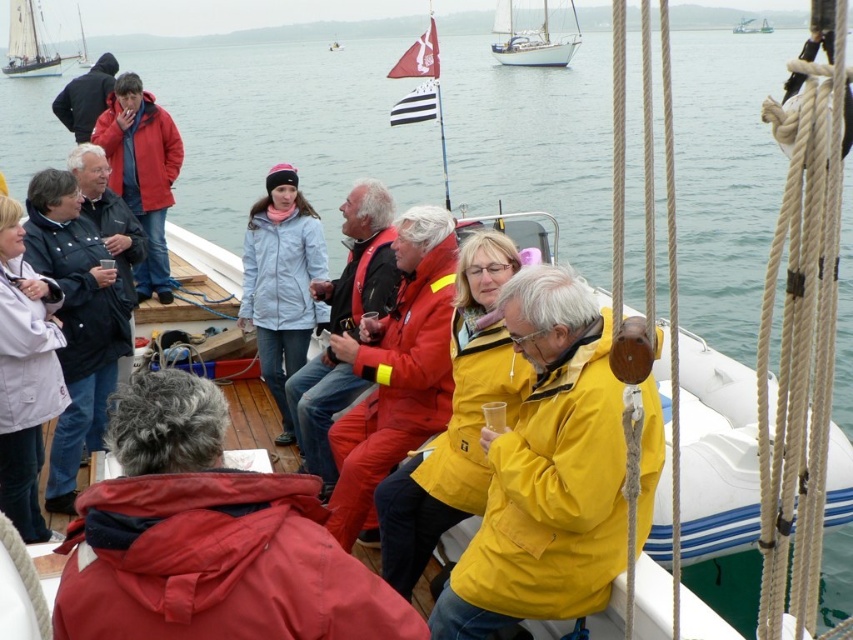
Question: From the image, what is the correct spatial relationship of matte light blue jacket at center in relation to matte red jacket at center?

Choices:
 (A) left
 (B) right

Answer: (A)

Question: Does red matte jacket at center have a smaller size compared to white glossy sailboat at upper center?

Choices:
 (A) yes
 (B) no

Answer: (A)

Question: Is red matte jacket at center further to the viewer compared to white glossy sailboat at upper center?

Choices:
 (A) no
 (B) yes

Answer: (A)

Question: Which point is closer to the camera taking this photo?

Choices:
 (A) (163, 150)
 (B) (9, 323)

Answer: (B)

Question: Which of these objects is positioned closest to the red waterproof suit at center?

Choices:
 (A) matte red jacket at center
 (B) yellow matte jacket at center
 (C) white plastic boat at center
 (D) dark blue jacket at upper left

Answer: (A)

Question: Which object appears farthest from the camera in this image?

Choices:
 (A) white matte jacket at upper left
 (B) dark blue jacket at upper left
 (C) red matte jacket at center

Answer: (B)